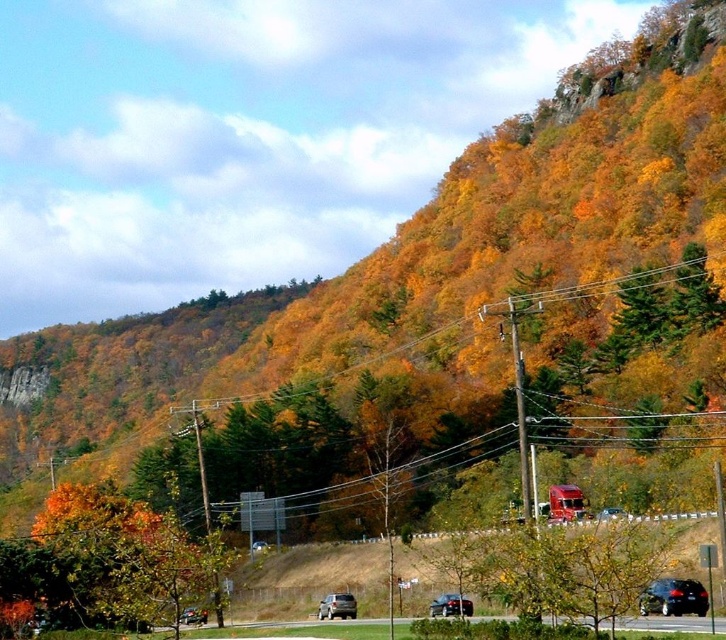
Question: Is orange leafy tree at lower left wider than shiny black sedan at lower left?

Choices:
 (A) no
 (B) yes

Answer: (B)

Question: Among these points, which one is farthest from the camera?

Choices:
 (A) (672, 596)
 (B) (48, 545)
 (C) (449, 605)

Answer: (B)

Question: Which object is closer to the camera taking this photo?

Choices:
 (A) shiny black sedan at lower right
 (B) orange leafy tree at lower left
 (C) shiny black sedan at lower left
 (D) metallic wire at upper center

Answer: (A)

Question: Is metallic wire at upper center wider than shiny black sedan at lower right?

Choices:
 (A) yes
 (B) no

Answer: (A)

Question: Among these objects, which one is farthest from the camera?

Choices:
 (A) orange leafy tree at lower left
 (B) shiny black sedan at lower right

Answer: (A)

Question: Is metallic wire at upper center bigger than shiny black sedan at lower right?

Choices:
 (A) yes
 (B) no

Answer: (A)